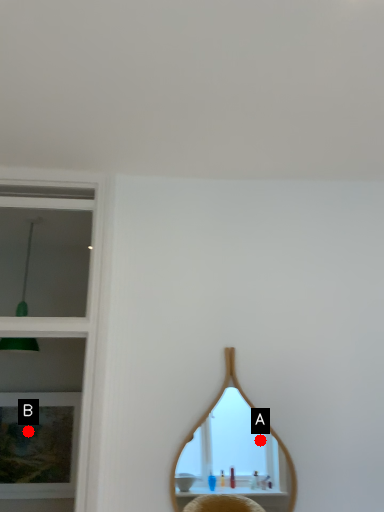
Question: Two points are circled on the image, labeled by A and B beside each circle. Which of the following is the closest to the observer?

Choices:
 (A) A is closer
 (B) B is closer

Answer: (B)